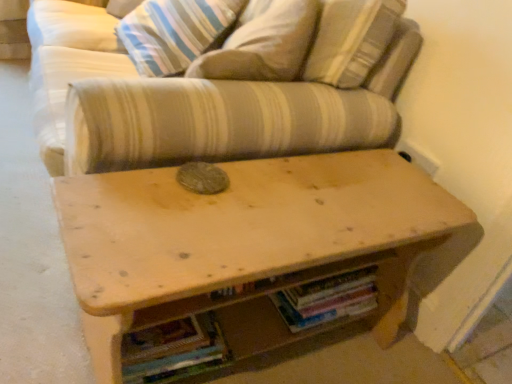
This screenshot has height=384, width=512. Find the location of `vacant region above wooden table at center (from a real-world perspective)`. vacant region above wooden table at center (from a real-world perspective) is located at coordinates (290, 204).